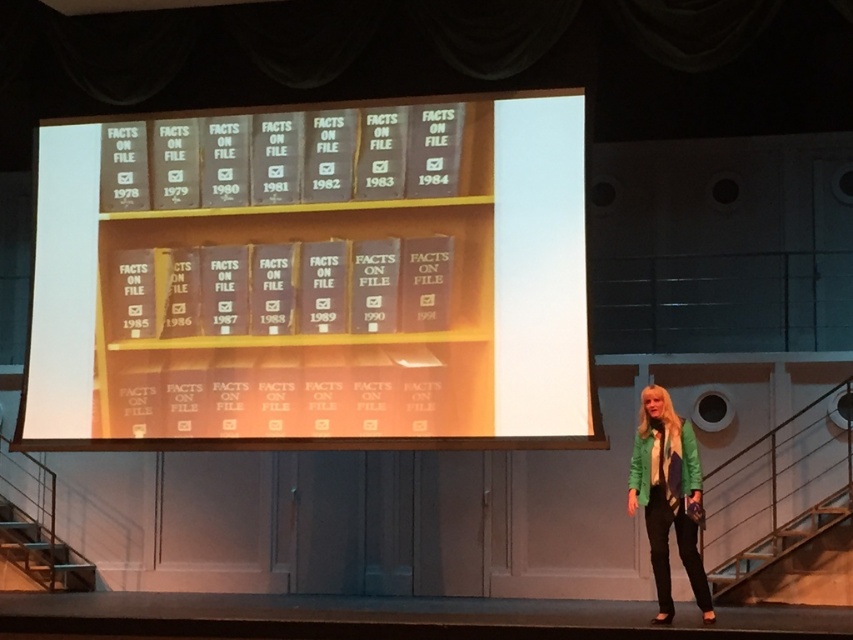
You are an attendee at the presentation and want to see both the matte gray bookshelf at center and the green leather jacket at lower right. Which object is higher in the image?

The matte gray bookshelf at center is above the green leather jacket at lower right, so the matte gray bookshelf at center is higher in the image.

You are an attendee at the presentation and want to see both the matte gray bookshelf at center and the green matte jacket at lower right. Which object is positioned higher in the image?

The matte gray bookshelf at center is located above the green matte jacket at lower right, so it is positioned higher in the image.

Based on the scene description, where is the matte gray bookshelf at center located in the image?

The matte gray bookshelf at center is located at point (312, 280).